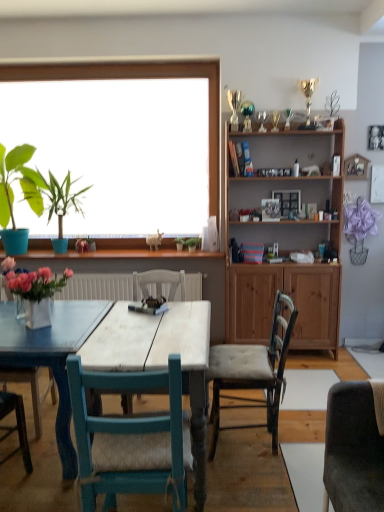
Find the location of a particular element. empty space that is ontop of white wood table at center is located at coordinates pyautogui.click(x=152, y=325).